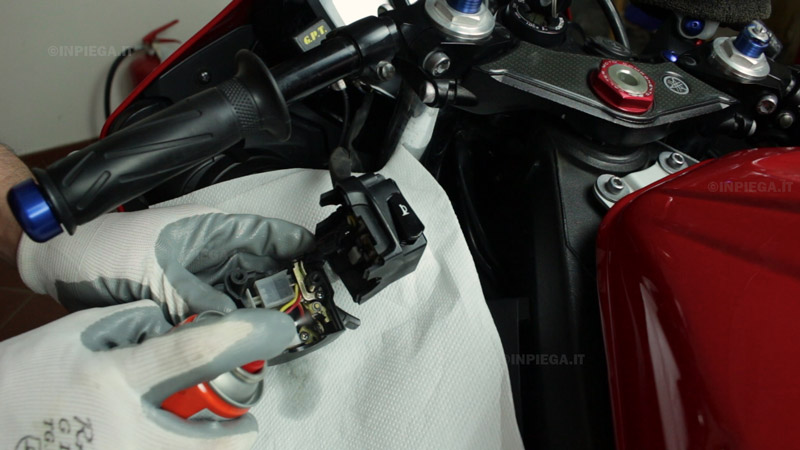
This screenshot has height=450, width=800. Find the location of `wall`. wall is located at coordinates point(50,120).